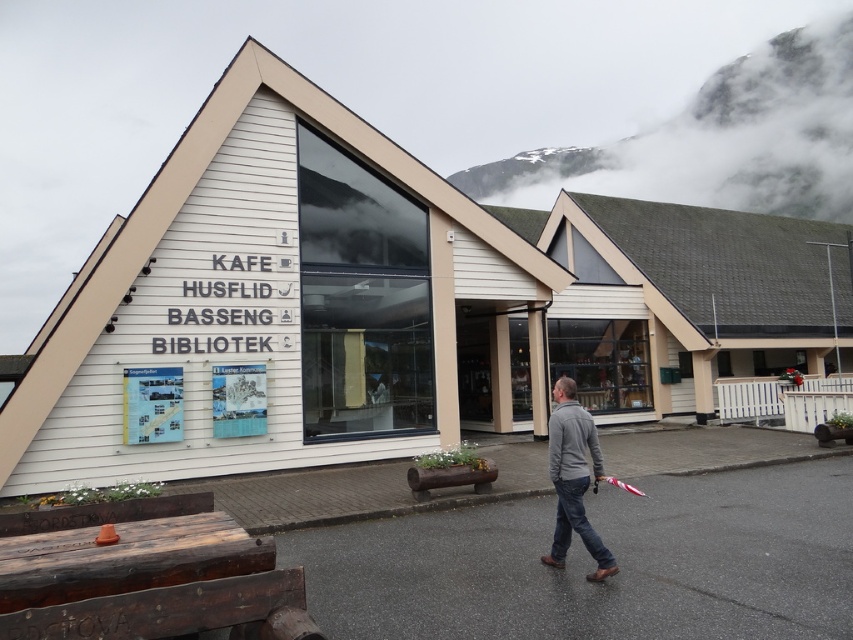
In the scene shown: Is gray asphalt at lower center further to camera compared to gray fabric jacket at center?

No, gray asphalt at lower center is in front of gray fabric jacket at center.

Does gray asphalt at lower center have a lesser height compared to gray fabric jacket at center?

Yes.

In order to click on gray asphalt at lower center in this screenshot , I will do `click(593, 564)`.

I want to click on white wood building at center, so click(x=387, y=305).

Does point (122, 314) come in front of point (560, 426)?

No, it is not.

The width and height of the screenshot is (853, 640). I want to click on white wood building at center, so click(387, 305).

Does white wood building at center appear on the left side of gray asphalt at lower center?

No, white wood building at center is not to the left of gray asphalt at lower center.

From the picture: Does white wood building at center come in front of gray asphalt at lower center?

That is False.

The height and width of the screenshot is (640, 853). Identify the location of white wood building at center. (387, 305).